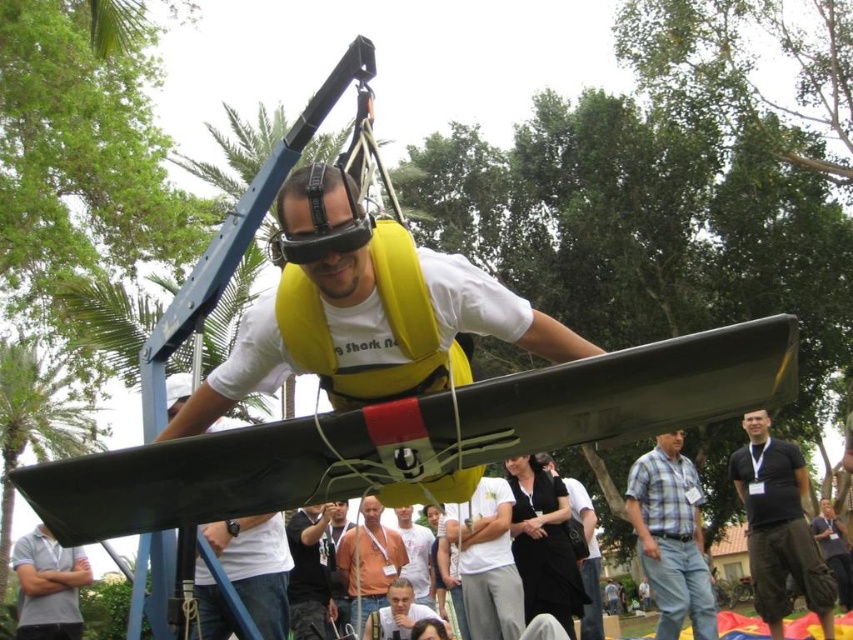
Is white matte shirt at center positioned behind white shirt at center?

No, white matte shirt at center is closer to the viewer.

Which of these two, white matte shirt at center or white shirt at center, stands shorter?

white shirt at center

Is point (242, 579) in front of point (422, 572)?

Yes, it is.

You are a GUI agent. You are given a task and a screenshot of the screen. Output one action in this format:
    pyautogui.click(x=<x>, y=<y>)
    Task: Click on the white matte shirt at center
    This screenshot has height=640, width=853.
    Given the screenshot: What is the action you would take?
    pyautogui.click(x=254, y=566)

How much distance is there between brown fabric shirt at center and light brown leather jacket at lower center?

brown fabric shirt at center is 3.83 feet away from light brown leather jacket at lower center.

Who is lower down, brown fabric shirt at center or light brown leather jacket at lower center?

light brown leather jacket at lower center is lower down.

Between point (397, 532) and point (379, 612), which one is positioned in front?

Point (379, 612) is more forward.

Where is `brown fabric shirt at center`? The height and width of the screenshot is (640, 853). brown fabric shirt at center is located at coordinates coord(368,563).

Between black cotton shirt at lower right and plaid cotton shirt at center, which one is positioned higher?

Positioned higher is black cotton shirt at lower right.

Can you confirm if black cotton shirt at lower right is positioned to the right of plaid cotton shirt at center?

Correct, you'll find black cotton shirt at lower right to the right of plaid cotton shirt at center.

The height and width of the screenshot is (640, 853). Find the location of `black cotton shirt at lower right`. black cotton shirt at lower right is located at coordinates (778, 525).

Where is `black cotton shirt at lower right`? The height and width of the screenshot is (640, 853). black cotton shirt at lower right is located at coordinates point(778,525).